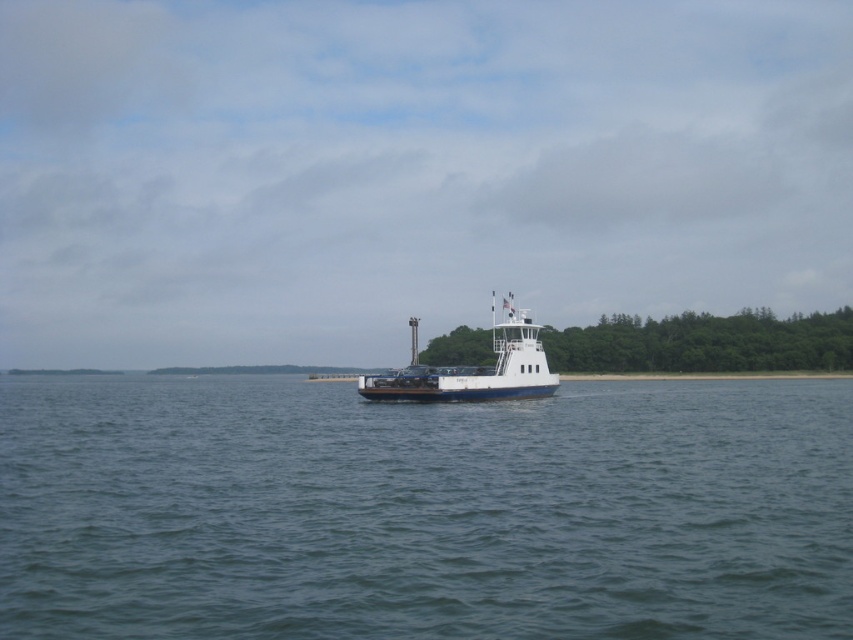
You are standing on the deck of the ferry boat and want to reach the point marked at coordinates point (126, 388). Given that the ferry is 250 feet long, will you be able to walk from the front of the ferry to this point without stepping off the deck?

The point (126, 388) is 274.66 feet from the viewer. Since the ferry is only 250 feet long, walking from the front would require going beyond the ferry length, so you cannot reach the point without stepping off the deck.

You are a passenger on the ferry and want to know if the blue water at center is higher or lower than the white glossy ferry at center. Based on the scene, what can you conclude?

The blue water at center is not as tall as the white glossy ferry at center, so the water is lower than the ferry.